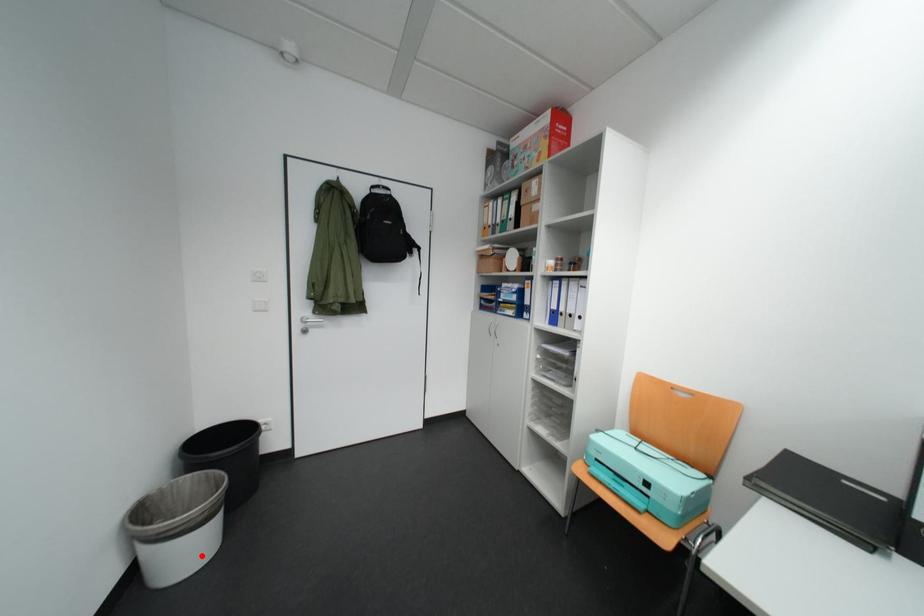
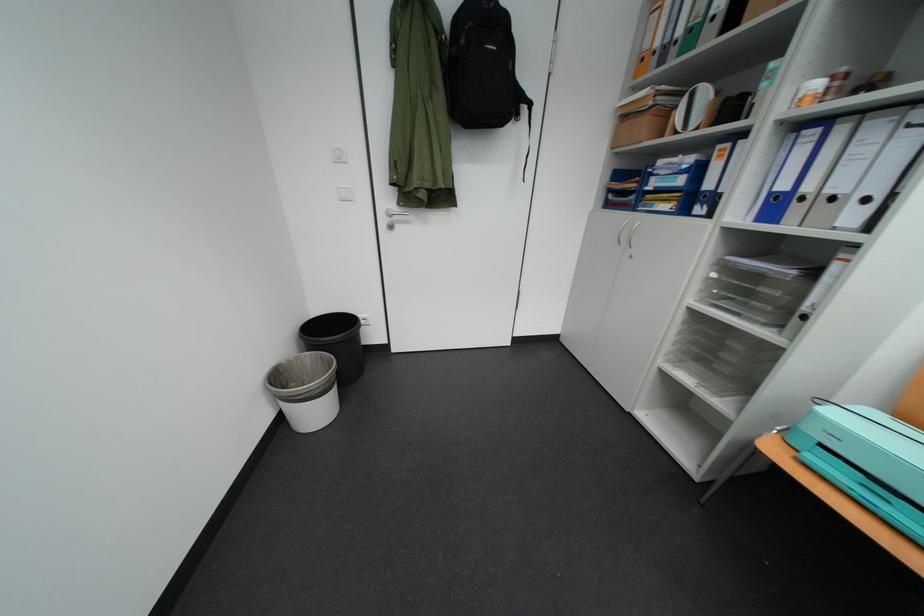
Question: I am providing you with two images of the same scene from different viewpoints. Given a red point in image1, look at the same physical point in image2. Is it:

Choices:
 (A) Closer to the viewpoint
 (B) Farther from the viewpoint

Answer: (B)